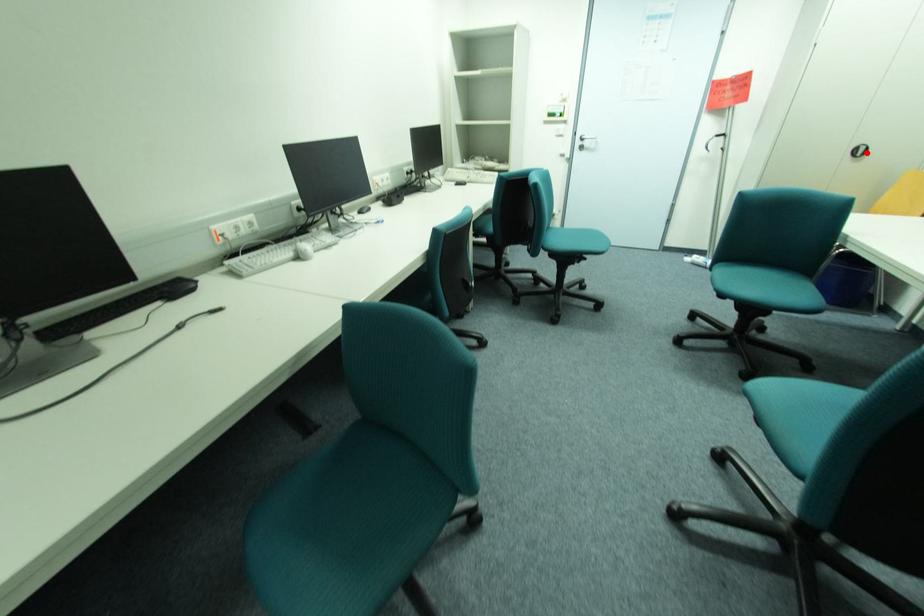
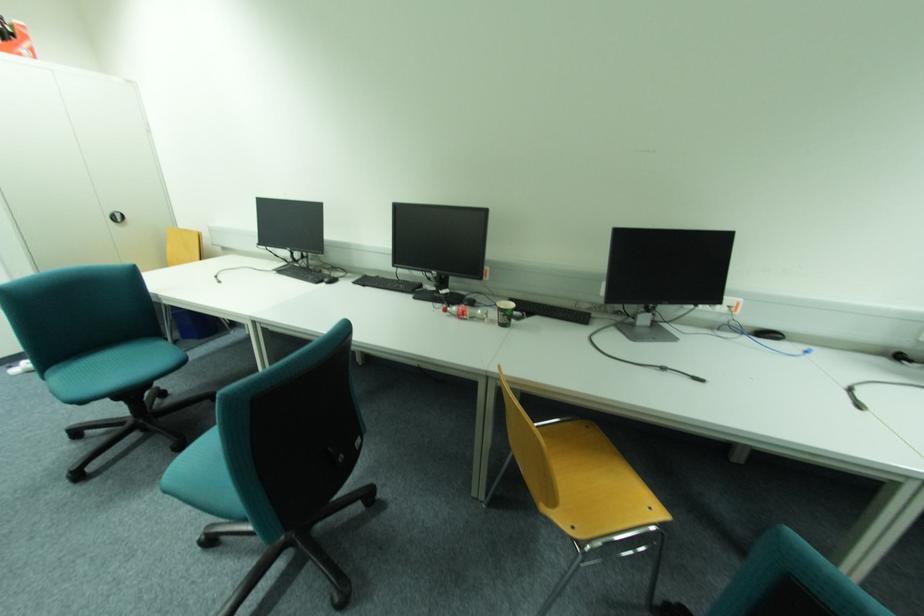
The point at the highlighted location is marked in the first image. Where is the corresponding point in the second image?

(126, 219)